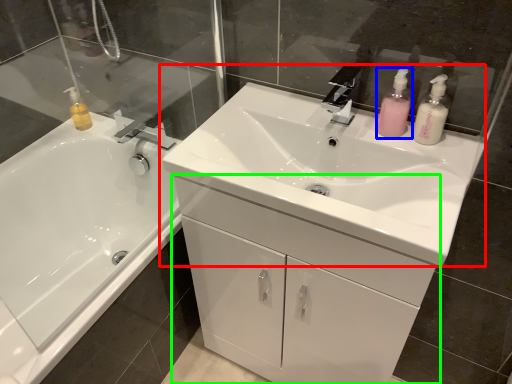
Question: Which object is positioned closest to sink (highlighted by a red box)? Select from toiletry (highlighted by a blue box) and bathroom cabinet (highlighted by a green box).

Choices:
 (A) toiletry
 (B) bathroom cabinet

Answer: (B)